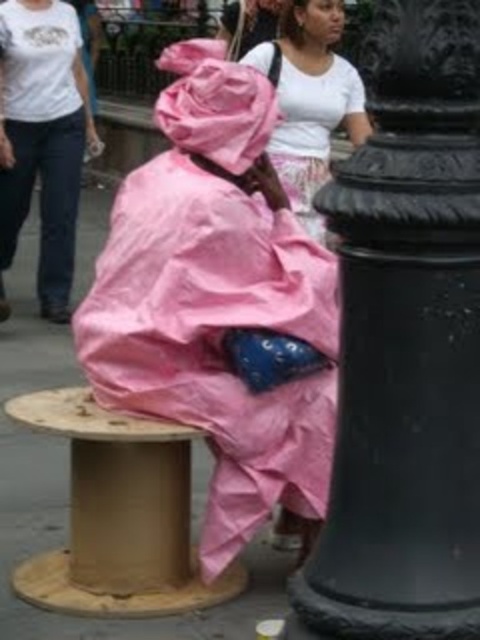
Question: Which point is farther to the camera?

Choices:
 (A) cardboard spool at center
 (B) pink plastic bag at center
 (C) black cast iron post at right
 (D) matte pink fabric at center

Answer: (D)

Question: Does cardboard spool at center have a smaller size compared to pink plastic bag at lower left?

Choices:
 (A) no
 (B) yes

Answer: (B)

Question: Where is cardboard spool at center located in relation to matte pink fabric at center in the image?

Choices:
 (A) left
 (B) right

Answer: (A)

Question: Which of the following is the closest to the observer?

Choices:
 (A) matte pink fabric at center
 (B) black cast iron post at right
 (C) pink plastic bag at center
 (D) pink plastic bag at lower left

Answer: (B)

Question: Can you confirm if black cast iron post at right is positioned above matte pink fabric at center?

Choices:
 (A) yes
 (B) no

Answer: (B)

Question: Which point is closer to the camera?

Choices:
 (A) (12, 60)
 (B) (311, 397)

Answer: (B)